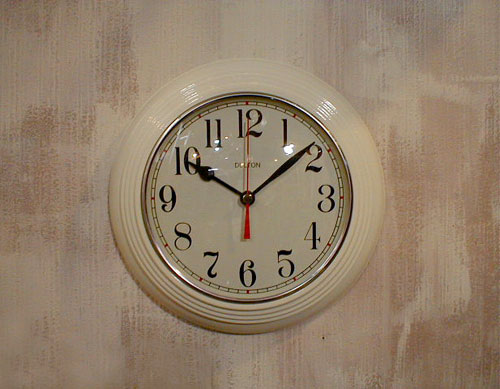
Identify the location of clock. The width and height of the screenshot is (500, 389). (308, 92).